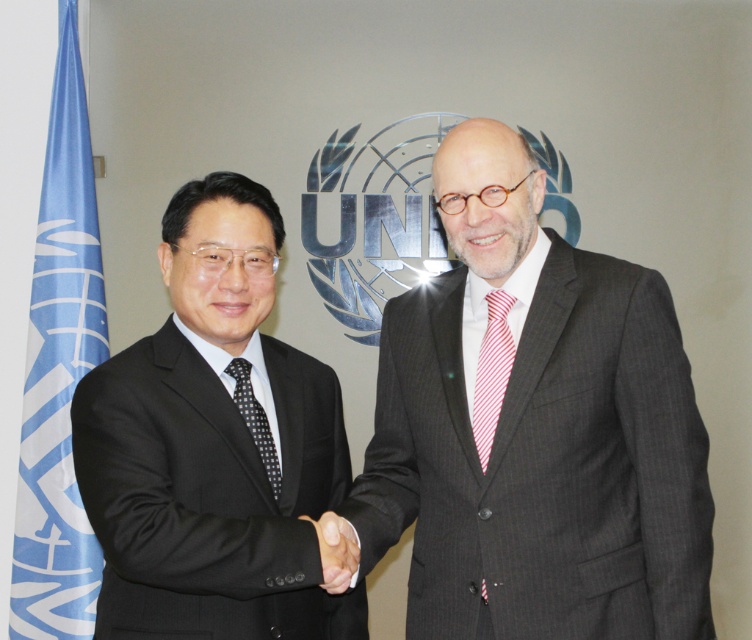
Does point (611, 464) come closer to viewer compared to point (350, 544)?

No.

Between gray pinstripe suit at center and black matte hand at center, which one is positioned higher?

gray pinstripe suit at center

Describe the element at coordinates (535, 429) in the screenshot. I see `gray pinstripe suit at center` at that location.

Locate an element on the screen. This screenshot has width=752, height=640. gray pinstripe suit at center is located at coordinates (535, 429).

Does point (108, 508) come farther from viewer compared to point (508, 374)?

No, (108, 508) is in front of (508, 374).

Image resolution: width=752 pixels, height=640 pixels. What do you see at coordinates (214, 445) in the screenshot?
I see `black matte suit at left` at bounding box center [214, 445].

Which is behind, point (220, 273) or point (493, 339)?

The point (493, 339) is behind.

Locate an element on the screen. black matte suit at left is located at coordinates (214, 445).

Which is behind, point (487, 160) or point (214, 230)?

Point (214, 230)

Which is in front, point (522, 600) or point (302, 554)?

Positioned in front is point (302, 554).

Where is `gray pinstripe suit at center`? The width and height of the screenshot is (752, 640). gray pinstripe suit at center is located at coordinates (535, 429).